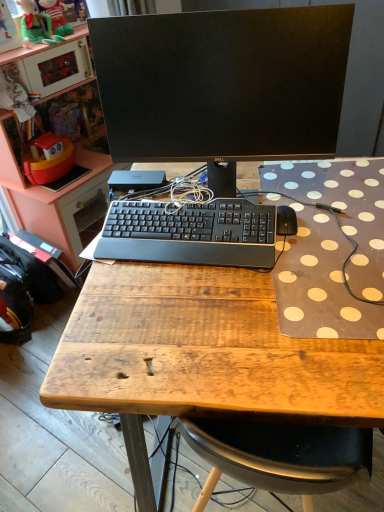
In order to face velvet green plush at upper left, the first toy in the top-to-bottom sequence, should I rotate leftwards or rightwards?

To align with it, rotate left about 18.783°.

Locate an element on the screen. The height and width of the screenshot is (512, 384). velvet green plush at upper left, arranged as the second toy when ordered from the bottom is located at coordinates (36, 25).

Where is `black matte mouse at right`? This screenshot has height=512, width=384. black matte mouse at right is located at coordinates (286, 221).

In order to click on matte pink cabinet at upper left in this screenshot , I will do pyautogui.click(x=60, y=155).

Image resolution: width=384 pixels, height=512 pixels. What do you see at coordinates (60, 155) in the screenshot?
I see `matte pink cabinet at upper left` at bounding box center [60, 155].

The height and width of the screenshot is (512, 384). What do you see at coordinates (201, 355) in the screenshot? I see `wooden desk at center` at bounding box center [201, 355].

The image size is (384, 512). What do you see at coordinates (190, 234) in the screenshot?
I see `black matte keyboard at center` at bounding box center [190, 234].

The image size is (384, 512). What are the coordinates of `velvet green plush at upper left, arranged as the second toy when ordered from the bottom` in the screenshot? It's located at (36, 25).

Could you measure the distance between black fabric backpack at lower left, which is counted as the 1th backpack, starting from the back, and matte pink cabinet at upper left?

42.40 centimeters.

Does black fabric backpack at lower left, acting as the second backpack starting from the front, have a greater height compared to matte pink cabinet at upper left?

No.

Is black fabric backpack at lower left, acting as the second backpack starting from the front, next to matte pink cabinet at upper left and touching it?

No, black fabric backpack at lower left, acting as the second backpack starting from the front, is not making contact with matte pink cabinet at upper left.

Is black fabric backpack at lower left, acting as the second backpack starting from the front, inside or outside of matte pink cabinet at upper left?

black fabric backpack at lower left, acting as the second backpack starting from the front, is spatially situated outside matte pink cabinet at upper left.

From a real-world perspective, is green plush toy at upper left, marked as the second toy in a top-to-bottom arrangement, below black matte mouse at right?

Actually, green plush toy at upper left, marked as the second toy in a top-to-bottom arrangement, is physically above black matte mouse at right in the real world.

In the scene shown: From the image's perspective, is green plush toy at upper left, marked as the second toy in a top-to-bottom arrangement, under black matte mouse at right?

No.

Can you confirm if green plush toy at upper left, marked as the second toy in a top-to-bottom arrangement, is thinner than black matte mouse at right?

No.

Between green plush toy at upper left, marked as the second toy in a top-to-bottom arrangement, and black leather backpack at lower left, which is the second backpack in back-to-front order, which one has larger size?

black leather backpack at lower left, which is the second backpack in back-to-front order.

In terms of height, does green plush toy at upper left, marked as the second toy in a top-to-bottom arrangement, look taller or shorter compared to black leather backpack at lower left, which appears as the first backpack when viewed from the front?

Considering their sizes, green plush toy at upper left, marked as the second toy in a top-to-bottom arrangement, has less height than black leather backpack at lower left, which appears as the first backpack when viewed from the front.

Do you think green plush toy at upper left, which is the first toy from bottom to top, is within black leather backpack at lower left, which appears as the first backpack when viewed from the front, or outside of it?

green plush toy at upper left, which is the first toy from bottom to top, is located beyond the bounds of black leather backpack at lower left, which appears as the first backpack when viewed from the front.

Based on the photo, does black matte mouse at right appear on the right side of black matte monitor at center?

Yes, black matte mouse at right is to the right of black matte monitor at center.

Does black matte mouse at right have a lesser width compared to black matte monitor at center?

Yes.

Is black matte mouse at right facing towards black matte monitor at center?

No, black matte mouse at right is not facing towards black matte monitor at center.

Can we say black matte mouse at right lies outside black matte monitor at center?

No.

Is point (18, 249) in front of point (63, 21)?

No, (18, 249) is further to viewer.

Looking at this image, is black fabric backpack at lower left, acting as the second backpack starting from the front, positioned with its back to green plush toy at upper left, which is the first toy from bottom to top?

black fabric backpack at lower left, acting as the second backpack starting from the front, does not have its back to green plush toy at upper left, which is the first toy from bottom to top.

Which of these two, black fabric backpack at lower left, acting as the second backpack starting from the front, or green plush toy at upper left, which is the first toy from bottom to top, stands shorter?

With less height is green plush toy at upper left, which is the first toy from bottom to top.

Is black fabric backpack at lower left, which is counted as the 1th backpack, starting from the back, far from green plush toy at upper left, which is the first toy from bottom to top?

No, black fabric backpack at lower left, which is counted as the 1th backpack, starting from the back, is in close proximity to green plush toy at upper left, which is the first toy from bottom to top.

Is black matte monitor at center touching black leather backpack at lower left, which is the second backpack in back-to-front order?

black matte monitor at center and black leather backpack at lower left, which is the second backpack in back-to-front order, are clearly separated.

Which of these two, black matte monitor at center or black leather backpack at lower left, which is the second backpack in back-to-front order, is wider?

black leather backpack at lower left, which is the second backpack in back-to-front order.

Between black matte monitor at center and black leather backpack at lower left, which appears as the first backpack when viewed from the front, which one has larger size?

black matte monitor at center is bigger.

Does black matte monitor at center appear on the left side of black leather backpack at lower left, which is the second backpack in back-to-front order?

Incorrect, black matte monitor at center is not on the left side of black leather backpack at lower left, which is the second backpack in back-to-front order.

Considering the points (283, 227) and (10, 246), which point is in front, point (283, 227) or point (10, 246)?

The point (283, 227) is closer to the camera.

How much distance is there between black matte mouse at right and black fabric backpack at lower left, which is counted as the 1th backpack, starting from the back?

They are 3.98 feet apart.

Is black matte mouse at right in contact with black fabric backpack at lower left, acting as the second backpack starting from the front?

No.

Is black matte mouse at right further to the viewer compared to black fabric backpack at lower left, acting as the second backpack starting from the front?

No, black matte mouse at right is closer to the viewer.

There is a matte pink cabinet at upper left. Where is `the 1st backpack below it (from the image's perspective)`? The image size is (384, 512). the 1st backpack below it (from the image's perspective) is located at coordinates (34, 273).

Find the location of `toy that is the 1st one when counting upward from the black matte mouse at right (from the image's perspective)`. toy that is the 1st one when counting upward from the black matte mouse at right (from the image's perspective) is located at coordinates (56, 17).

Estimate the real-world distances between objects in this image. Which object is further from matte pink cabinet at upper left, black leather backpack at lower left, which is the second backpack in back-to-front order, or black matte keyboard at center?

Among the two, black matte keyboard at center is located further to matte pink cabinet at upper left.

Which object lies nearer to the anchor point black fabric backpack at lower left, acting as the second backpack starting from the front, green plush toy at upper left, marked as the second toy in a top-to-bottom arrangement, or black matte mouse at right?

Based on the image, green plush toy at upper left, marked as the second toy in a top-to-bottom arrangement, appears to be nearer to black fabric backpack at lower left, acting as the second backpack starting from the front.

Based on the photo, estimate the real-world distances between objects in this image. Which object is closer to black matte mouse at right, black fabric backpack at lower left, which is counted as the 1th backpack, starting from the back, or matte pink cabinet at upper left?

black fabric backpack at lower left, which is counted as the 1th backpack, starting from the back, is closer to black matte mouse at right.

Looking at the image, which one is located closer to velvet green plush at upper left, arranged as the second toy when ordered from the bottom, black matte mouse at right or black fabric backpack at lower left, which is counted as the 1th backpack, starting from the back?

black fabric backpack at lower left, which is counted as the 1th backpack, starting from the back, is closer to velvet green plush at upper left, arranged as the second toy when ordered from the bottom.

Estimate the real-world distances between objects in this image. Which object is further from matte pink cabinet at upper left, black matte monitor at center or wooden desk at center?

wooden desk at center lies further to matte pink cabinet at upper left than the other object.

Based on their spatial positions, is velvet green plush at upper left, the first toy in the top-to-bottom sequence, or black matte mouse at right closer to black fabric backpack at lower left, which is counted as the 1th backpack, starting from the back?

velvet green plush at upper left, the first toy in the top-to-bottom sequence, lies closer to black fabric backpack at lower left, which is counted as the 1th backpack, starting from the back, than the other object.

Looking at the image, which one is located closer to black leather backpack at lower left, which appears as the first backpack when viewed from the front, velvet green plush at upper left, arranged as the second toy when ordered from the bottom, or black matte mouse at right?

Among the two, velvet green plush at upper left, arranged as the second toy when ordered from the bottom, is located nearer to black leather backpack at lower left, which appears as the first backpack when viewed from the front.

Based on their spatial positions, is wooden desk at center or matte pink cabinet at upper left further from black fabric backpack at lower left, acting as the second backpack starting from the front?

wooden desk at center is positioned further to the anchor black fabric backpack at lower left, acting as the second backpack starting from the front.

Locate an element on the screen. The image size is (384, 512). computer keyboard between green plush toy at upper left, which is the first toy from bottom to top, and black fabric backpack at lower left, which is counted as the 1th backpack, starting from the back, vertically is located at coordinates (190, 234).

Identify the location of mouse that lies between green plush toy at upper left, marked as the second toy in a top-to-bottom arrangement, and black fabric backpack at lower left, acting as the second backpack starting from the front, from top to bottom. (286, 221).

What are the coordinates of `backpack between black leather backpack at lower left, which appears as the first backpack when viewed from the front, and wooden desk at center` in the screenshot? It's located at (34, 273).

Identify the location of toy that lies between velvet green plush at upper left, the first toy in the top-to-bottom sequence, and black fabric backpack at lower left, which is counted as the 1th backpack, starting from the back, from top to bottom. (56, 17).